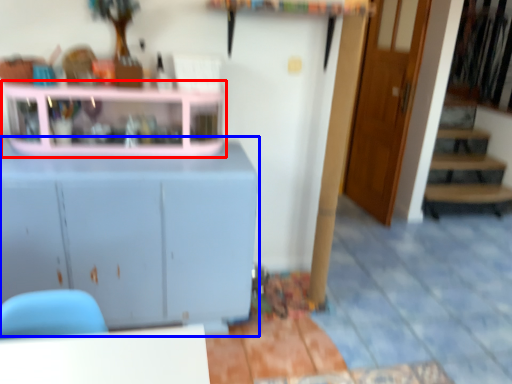
Question: Which object is further to the camera taking this photo, shelf (highlighted by a red box) or cabinetry (highlighted by a blue box)?

Choices:
 (A) shelf
 (B) cabinetry

Answer: (A)